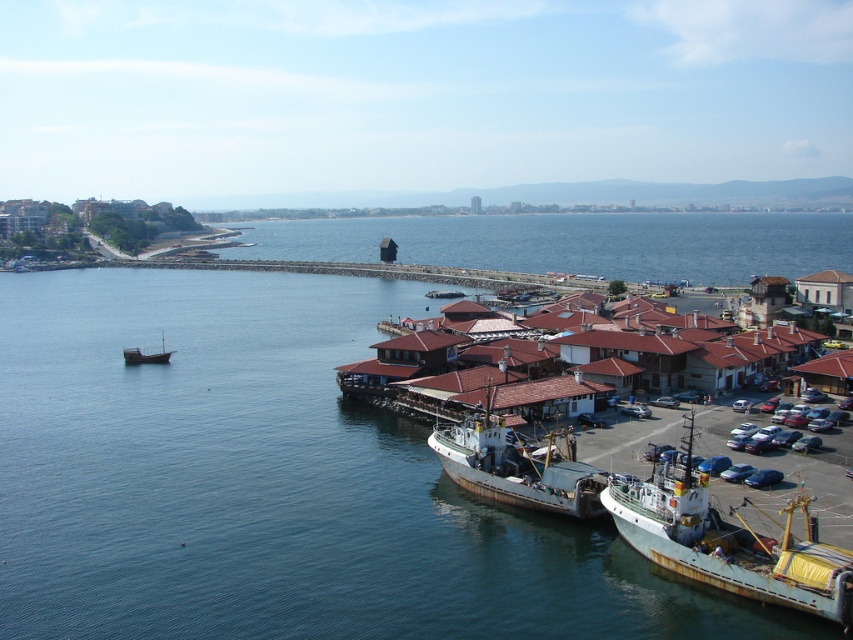
You are standing on the shore looking out at the scene. Which object is closer to you, the blue water at center or the wooden boat at left?

The blue water at center is closer to you because it is in front of the wooden boat at left.

You are a tour guide explaining the harbor layout to visitors. You point out the blue water at center and the rusty metal ship at lower right. How far apart are these two landmarks?

The blue water at center is 21.47 meters from the rusty metal ship at lower right.

You are standing at the point marked by the coordinates point (273, 483) in the image. Based on the scene description, what do you see around you?

The point (273, 483) marks blue water at center, so you are surrounded by calm blue waters with two fishing boats docked near the shore, one larger trawler and a smaller one closer to the shore. The middle ground includes a row of traditional red tiled roof buildings along the waterfront.